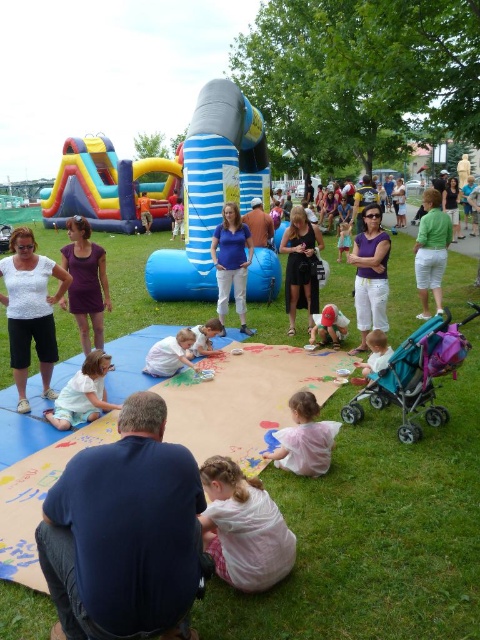
You are standing in the middle of the grassy area and want to place a small flag at the point closer to you between point (296, 289) and point (348, 236). Which point should you choose?

You should choose point (296, 289) because it is closer to the camera than point (348, 236).

Consider the image. You are standing at the center of the image. Which direction should you move to reach the point at coordinates point (83,394)?

The point at coordinates point (83,394) is located on the light pink fabric at lower left, so you should move towards the lower left direction to reach it.